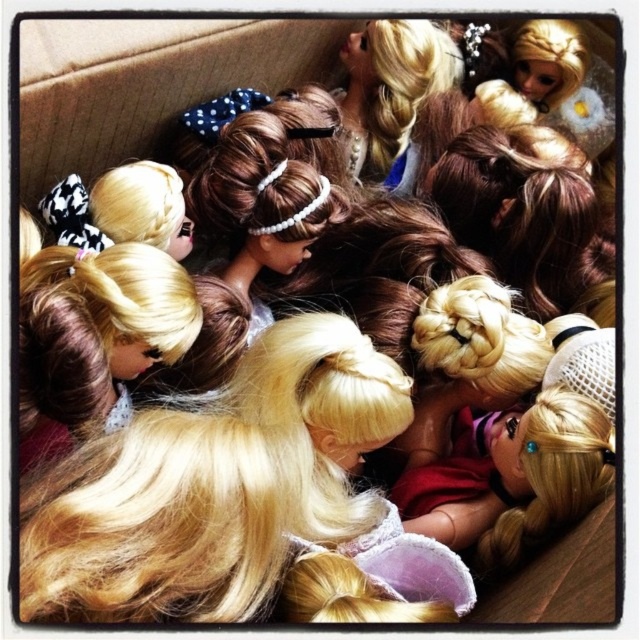
Between point (388, 573) and point (486, 566), which one is positioned in front?

Positioned in front is point (388, 573).

What do you see at coordinates (241, 500) in the screenshot?
I see `blonde hair at center` at bounding box center [241, 500].

At what (x,y) coordinates should I click in order to perform the action: click on blonde hair at center. Please return your answer as a coordinate pair (x, y). The image size is (640, 640). Looking at the image, I should click on (241, 500).